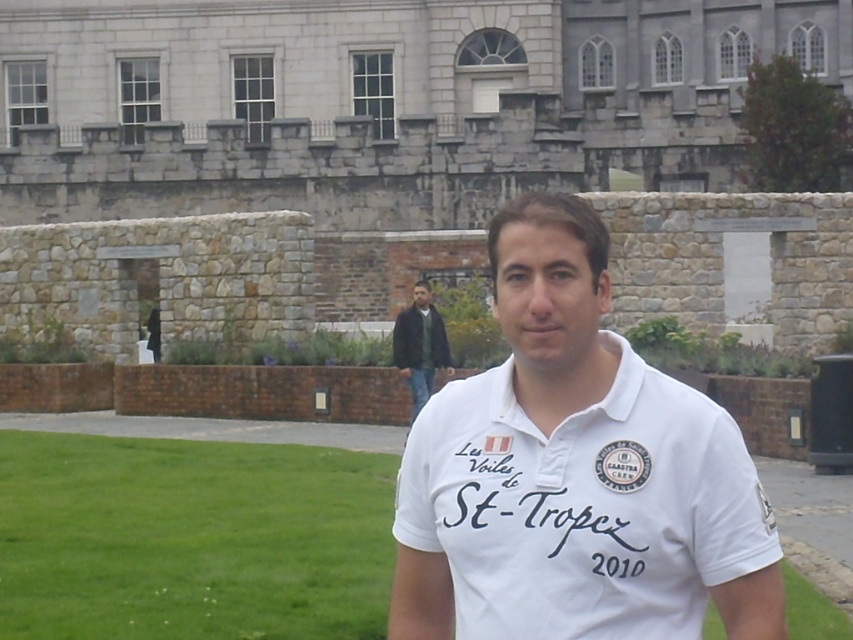
Where is `white cotton polo shirt at center`? This screenshot has height=640, width=853. white cotton polo shirt at center is located at coordinates (575, 472).

Who is more forward, (445, 588) or (376, 577)?

Point (445, 588) is more forward.

Locate an element on the screen. white cotton polo shirt at center is located at coordinates (575, 472).

Is white cotton polo shirt at center wider than dark green leather jacket at center?

Yes, white cotton polo shirt at center is wider than dark green leather jacket at center.

Is white cotton polo shirt at center to the left of dark green leather jacket at center from the viewer's perspective?

In fact, white cotton polo shirt at center is to the right of dark green leather jacket at center.

What do you see at coordinates (575, 472) in the screenshot? This screenshot has width=853, height=640. I see `white cotton polo shirt at center` at bounding box center [575, 472].

Where is `white cotton polo shirt at center`? Image resolution: width=853 pixels, height=640 pixels. white cotton polo shirt at center is located at coordinates (575, 472).

Does green grass at center have a greater width compared to dark green leather jacket at center?

Yes, green grass at center is wider than dark green leather jacket at center.

How much distance is there between green grass at center and dark green leather jacket at center?

A distance of 12.00 meters exists between green grass at center and dark green leather jacket at center.

Where is `green grass at center`? Image resolution: width=853 pixels, height=640 pixels. green grass at center is located at coordinates (190, 538).

Locate an element on the screen. green grass at center is located at coordinates (190, 538).